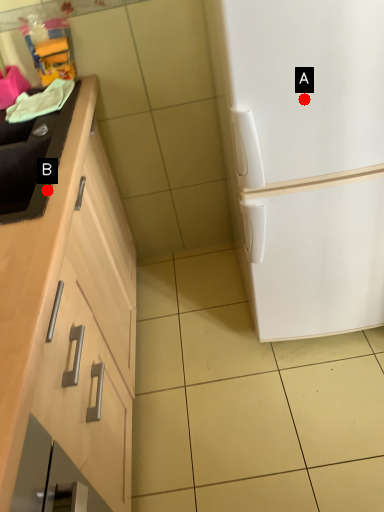
Question: Two points are circled on the image, labeled by A and B beside each circle. Which point appears farthest from the camera in this image?

Choices:
 (A) A is further
 (B) B is further

Answer: (A)